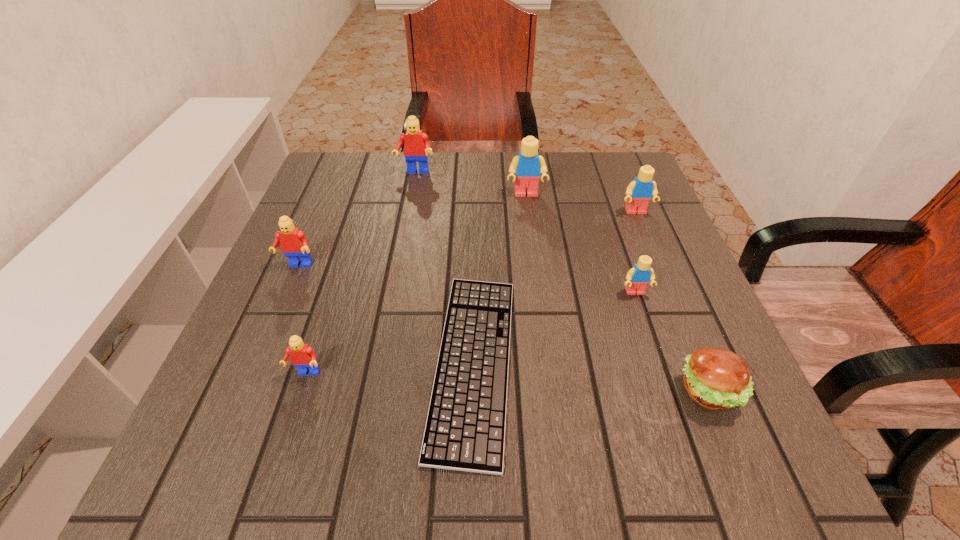
This screenshot has width=960, height=540. In order to click on the closest red Lego to the black computer keyboard in this screenshot , I will do `click(302, 356)`.

Find the location of a particular element. The image size is (960, 540). free space that satisfies the following two spatial constraints: 1. on the front-facing side of the fourth farthest Lego; 2. on the left side of the computer keyboard is located at coordinates (257, 362).